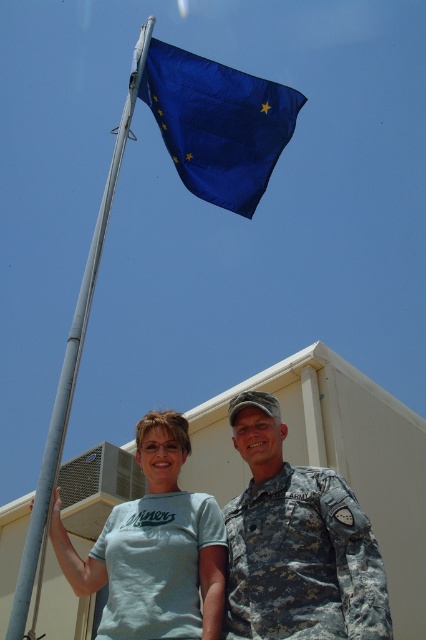
You are a photographer trying to capture a group photo of the camouflage uniform at center and the silver metallic flag pole at left. Based on their positions, which object should you place on the right side of your camera frame to ensure both are included?

The camouflage uniform at center is positioned on the right side of silver metallic flag pole at left, so you should place the silver metallic flag pole at left on the left side of your camera frame and the camouflage uniform at center on the right side to include both.

You are standing at the base of the flagpole and want to touch the blue fabric flag at upper center. The flag is 50.39 feet away from you. If you can only reach up to 6 feet, can you reach it?

The blue fabric flag at upper center is 50.39 feet from the viewer, which is much farther than your 6 feet reach. You cannot reach it.

You are a photographer trying to capture a photo of the camouflage uniform at center and the silver metallic flag pole at left. Based on their positions, which object is closer to the camera?

The camouflage uniform at center is positioned under the silver metallic flag pole at left, so it is closer to the camera than the flag pole.